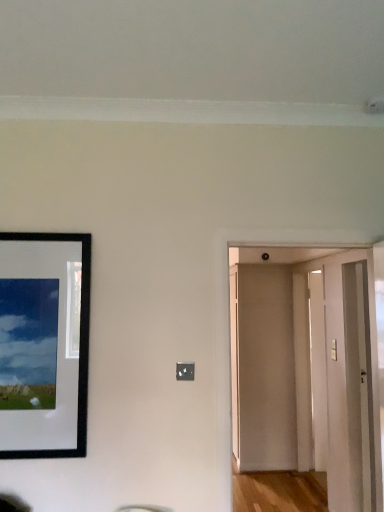
Question: Are black matte picture frame at left and beige matte door at center, marked as the 3th door in a front-to-back arrangement, beside each other?

Choices:
 (A) no
 (B) yes

Answer: (A)

Question: Is black matte picture frame at left looking in the opposite direction of beige matte door at center, placed as the 1th door when sorted from back to front?

Choices:
 (A) yes
 (B) no

Answer: (B)

Question: Is black matte picture frame at left closer to the viewer compared to beige matte door at center, placed as the 1th door when sorted from back to front?

Choices:
 (A) no
 (B) yes

Answer: (B)

Question: Can you confirm if black matte picture frame at left is thinner than beige matte door at center, marked as the 3th door in a front-to-back arrangement?

Choices:
 (A) yes
 (B) no

Answer: (A)

Question: Is beige matte door at center, placed as the 1th door when sorted from back to front, completely or partially inside black matte picture frame at left?

Choices:
 (A) no
 (B) yes

Answer: (A)

Question: From a real-world perspective, is transparent glass door at right physically located above or below beige matte door at center, marked as the 3th door in a front-to-back arrangement?

Choices:
 (A) above
 (B) below

Answer: (A)

Question: Would you say transparent glass door at right is inside or outside beige matte door at center, marked as the 3th door in a front-to-back arrangement?

Choices:
 (A) outside
 (B) inside

Answer: (A)

Question: In terms of size, does transparent glass door at right appear bigger or smaller than beige matte door at center, marked as the 3th door in a front-to-back arrangement?

Choices:
 (A) small
 (B) big

Answer: (B)

Question: Considering the positions of transparent glass door at right and beige matte door at center, marked as the 3th door in a front-to-back arrangement, in the image, is transparent glass door at right wider or thinner than beige matte door at center, marked as the 3th door in a front-to-back arrangement,?

Choices:
 (A) wide
 (B) thin

Answer: (A)

Question: Is point (87, 281) closer or farther from the camera than point (279, 373)?

Choices:
 (A) closer
 (B) farther

Answer: (A)

Question: Would you say black matte picture frame at left is inside or outside white wooden door at center, the 3th door in the back-to-front sequence?

Choices:
 (A) inside
 (B) outside

Answer: (B)

Question: From a real-world perspective, is black matte picture frame at left physically located above or below white wooden door at center, the 3th door in the back-to-front sequence?

Choices:
 (A) below
 (B) above

Answer: (B)

Question: Considering the positions of black matte picture frame at left and white wooden door at center, which is counted as the 1th door, starting from the front, in the image, is black matte picture frame at left bigger or smaller than white wooden door at center, which is counted as the 1th door, starting from the front,?

Choices:
 (A) small
 (B) big

Answer: (A)

Question: Is beige matte door at center, placed as the 1th door when sorted from back to front, inside the boundaries of white glossy door at right, which appears as the 2th door when viewed from the front, or outside?

Choices:
 (A) inside
 (B) outside

Answer: (B)

Question: From a real-world perspective, is beige matte door at center, placed as the 1th door when sorted from back to front, above or below white glossy door at right, the second door from the back?

Choices:
 (A) above
 (B) below

Answer: (A)